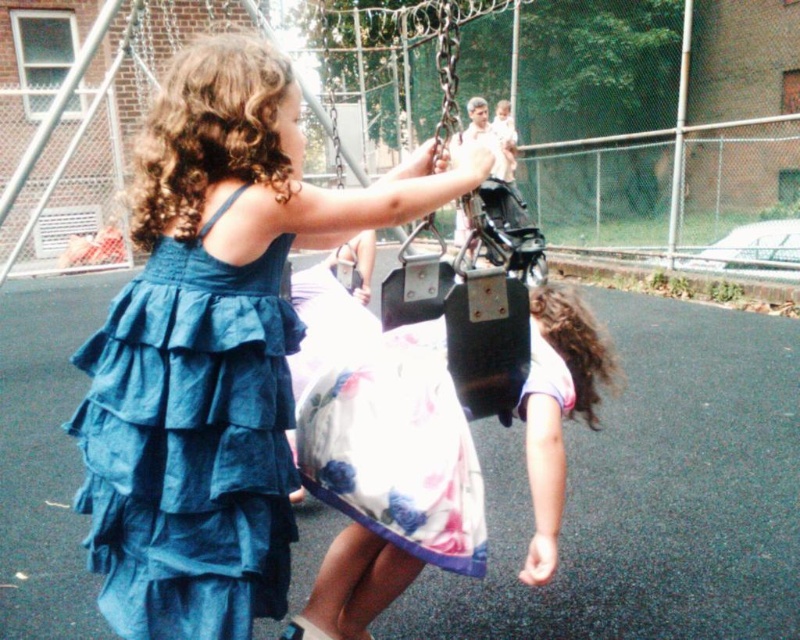
Question: Is blue cotton dress at center bigger than white floral dress at center?

Choices:
 (A) no
 (B) yes

Answer: (B)

Question: Is blue ruffled fabric dress at upper left above white floral dress at center?

Choices:
 (A) no
 (B) yes

Answer: (B)

Question: Among these objects, which one is farthest from the camera?

Choices:
 (A) white floral dress at center
 (B) blue cotton dress at center

Answer: (A)

Question: Considering the relative positions of floral satin dress at center and white floral dress at center in the image provided, where is floral satin dress at center located with respect to white floral dress at center?

Choices:
 (A) below
 (B) above

Answer: (B)

Question: Among these points, which one is nearest to the camera?

Choices:
 (A) 152,541
 (B) 308,616

Answer: (A)

Question: Among these points, which one is nearest to the camera?

Choices:
 (A) (445, 381)
 (B) (260, 262)
 (C) (160, 376)
 (D) (592, 416)

Answer: (C)